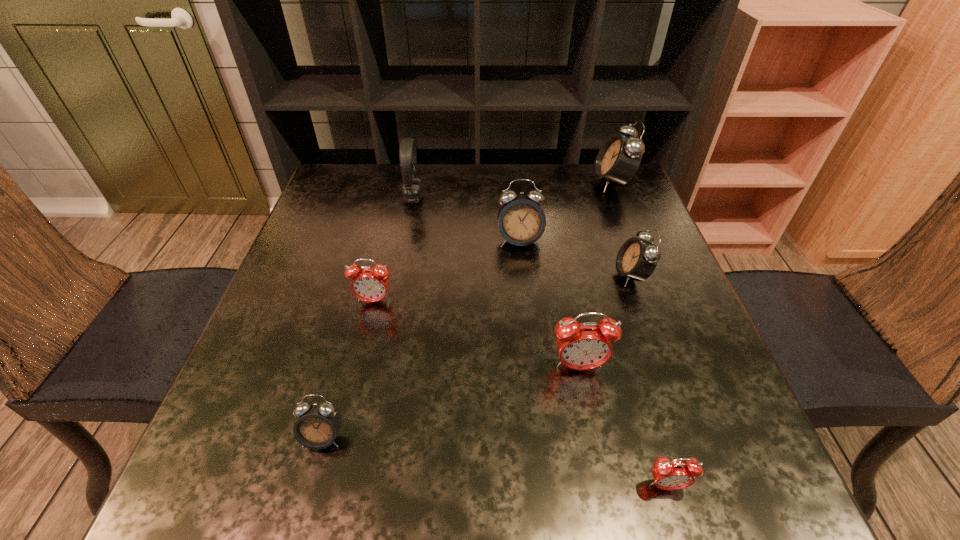
Find the location of a particular element. the tallest alarm clock is located at coordinates (619, 157).

Find the location of a particular element. the farthest alarm clock is located at coordinates (619, 157).

Locate an element on the screen. The height and width of the screenshot is (540, 960). headset is located at coordinates tap(412, 190).

Identify the location of the third nearest white alarm clock. Image resolution: width=960 pixels, height=540 pixels. (521, 221).

Identify the location of the third smallest white alarm clock. (521, 221).

Find the location of `the biggest red alarm clock`. the biggest red alarm clock is located at coordinates (581, 346).

Find the location of a particular element. the third nearest alarm clock is located at coordinates 581,346.

Identify the location of the fifth nearest alarm clock. The width and height of the screenshot is (960, 540). (637, 259).

What are the coordinates of `the second nearest white alarm clock` in the screenshot? It's located at (637, 259).

Where is `the fifth farthest object`? the fifth farthest object is located at coordinates (368, 284).